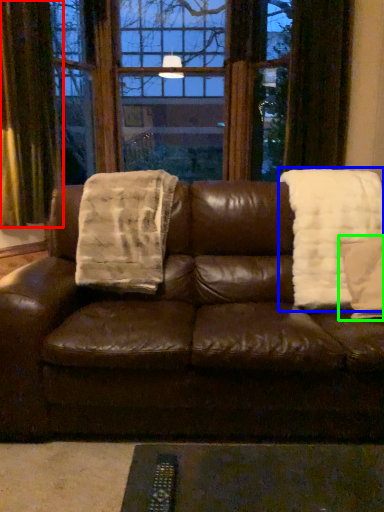
Question: Which object is positioned farthest from curtain (highlighted by a red box)? Select from blanket (highlighted by a blue box) and throw pillow (highlighted by a green box).

Choices:
 (A) blanket
 (B) throw pillow

Answer: (B)